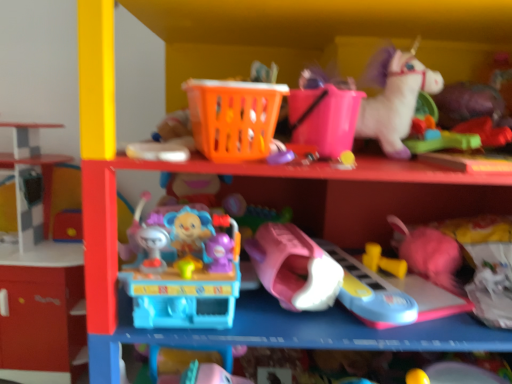
Question: Considering the relative sizes of pink plastic bucket at upper center, which is counted as the 5th toy, starting from the left, and green rubber toy at upper right, placed as the 9th toy when sorted from left to right, in the image provided, is pink plastic bucket at upper center, which is counted as the 5th toy, starting from the left, thinner than green rubber toy at upper right, placed as the 9th toy when sorted from left to right,?

Choices:
 (A) no
 (B) yes

Answer: (A)

Question: From the image's perspective, does pink plastic bucket at upper center, positioned as the sixth toy in right-to-left order, appear higher than green rubber toy at upper right, placed as the 9th toy when sorted from left to right?

Choices:
 (A) yes
 (B) no

Answer: (A)

Question: From a real-world perspective, is pink plastic bucket at upper center, which is counted as the 5th toy, starting from the left, positioned over green rubber toy at upper right, placed as the 9th toy when sorted from left to right, based on gravity?

Choices:
 (A) yes
 (B) no

Answer: (A)

Question: From a real-world perspective, does pink plastic bucket at upper center, which is counted as the 5th toy, starting from the left, sit lower than green rubber toy at upper right, which ranks as the 2th toy in right-to-left order?

Choices:
 (A) yes
 (B) no

Answer: (B)

Question: Does pink plastic bucket at upper center, which is counted as the 5th toy, starting from the left, lie behind green rubber toy at upper right, placed as the 9th toy when sorted from left to right?

Choices:
 (A) no
 (B) yes

Answer: (A)

Question: Based on their sizes in the image, would you say pink plastic toy car at center, the fourth toy in the left-to-right sequence, is bigger or smaller than smooth plastic shelf at left?

Choices:
 (A) small
 (B) big

Answer: (A)

Question: Looking at their shapes, would you say pink plastic toy car at center, placed as the 7th toy when sorted from right to left, is wider or thinner than smooth plastic shelf at left?

Choices:
 (A) thin
 (B) wide

Answer: (B)

Question: Visually, is pink plastic toy car at center, placed as the 7th toy when sorted from right to left, positioned to the left or to the right of smooth plastic shelf at left?

Choices:
 (A) right
 (B) left

Answer: (A)

Question: Relative to smooth plastic shelf at left, is pink plastic toy car at center, placed as the 7th toy when sorted from right to left, in front or behind?

Choices:
 (A) front
 (B) behind

Answer: (A)

Question: Considering the positions of pink plastic bucket at upper center, which is counted as the 5th toy, starting from the left, and white plush unicorn at upper right, marked as the 4th toy in a right-to-left arrangement, in the image, is pink plastic bucket at upper center, which is counted as the 5th toy, starting from the left, wider or thinner than white plush unicorn at upper right, marked as the 4th toy in a right-to-left arrangement,?

Choices:
 (A) wide
 (B) thin

Answer: (B)

Question: Is point (324, 147) closer or farther from the camera than point (401, 147)?

Choices:
 (A) farther
 (B) closer

Answer: (B)

Question: From their relative heights in the image, would you say pink plastic bucket at upper center, which is counted as the 5th toy, starting from the left, is taller or shorter than white plush unicorn at upper right, marked as the 4th toy in a right-to-left arrangement?

Choices:
 (A) tall
 (B) short

Answer: (B)

Question: From a real-world perspective, relative to white plush unicorn at upper right, marked as the 4th toy in a right-to-left arrangement, is pink plastic bucket at upper center, positioned as the sixth toy in right-to-left order, vertically above or below?

Choices:
 (A) below
 (B) above

Answer: (A)

Question: In terms of height, does pink plastic toy car at center, the fourth toy in the left-to-right sequence, look taller or shorter compared to green rubber toy at upper right, placed as the 9th toy when sorted from left to right?

Choices:
 (A) short
 (B) tall

Answer: (B)

Question: In terms of size, does pink plastic toy car at center, the fourth toy in the left-to-right sequence, appear bigger or smaller than green rubber toy at upper right, placed as the 9th toy when sorted from left to right?

Choices:
 (A) small
 (B) big

Answer: (B)